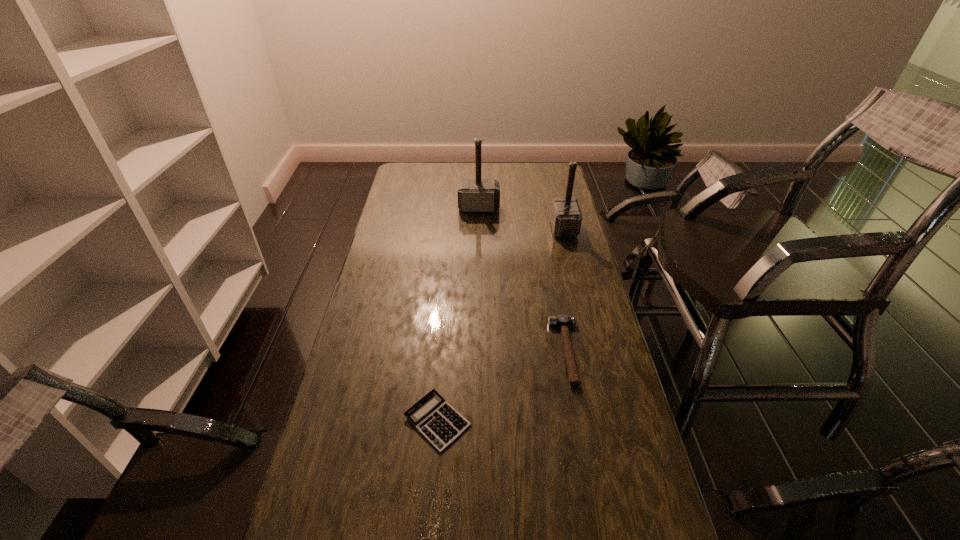
You are a GUI agent. You are given a task and a screenshot of the screen. Output one action in this format:
    pyautogui.click(x=<x>, y=<y>)
    Task: Click on the second closest hammer to the third tallest object
    
    Given the screenshot: What is the action you would take?
    pyautogui.click(x=474, y=195)

Identify the location of free space that satisfies the following two spatial constraints: 1. for striking with the head of the leftmost hammer; 2. on the left side of the third nearest object. (479, 229).

Identify the location of vacant point that satisfies the following two spatial constraints: 1. on the back side of the nearest object; 2. on the left side of the second farthest hammer. (453, 229).

Locate an element on the screen. free spot that satisfies the following two spatial constraints: 1. for striking with the head of the leftmost hammer; 2. on the right side of the second farthest object is located at coordinates (479, 229).